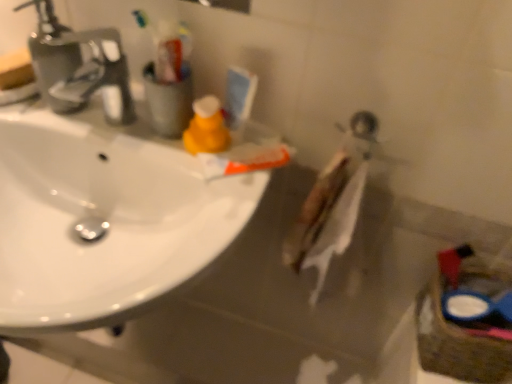
Measure the distance between white glossy sink at upper left and camera.

The depth of white glossy sink at upper left is 18.52 inches.

This screenshot has width=512, height=384. What do you see at coordinates (79, 66) in the screenshot? I see `satin nickel faucet at upper left` at bounding box center [79, 66].

Find the location of `white matte toothpaste at center`. white matte toothpaste at center is located at coordinates (244, 159).

What is the approximate width of white matte toothpaste at center?

16.40 centimeters.

What are the coordinates of `matte orange spray bottle at upper center` in the screenshot? It's located at (206, 127).

Is point (214, 158) positioned behind point (227, 129)?

That is False.

Is matte orange spray bottle at upper center at the back of white matte toothpaste at center?

No, white matte toothpaste at center's orientation is not away from matte orange spray bottle at upper center.

Is matte orange spray bottle at upper center completely or partially inside white matte toothpaste at center?

No, matte orange spray bottle at upper center is not inside white matte toothpaste at center.

From a real-world perspective, is white matte toothpaste at center on top of matte orange spray bottle at upper center?

No, from a real-world perspective, white matte toothpaste at center is not over matte orange spray bottle at upper center

From a real-world perspective, is matte orange spray bottle at upper center below white glossy sink at upper left?

Incorrect, from a real-world perspective, matte orange spray bottle at upper center is higher than white glossy sink at upper left.

Image resolution: width=512 pixels, height=384 pixels. What are the coordinates of `sink below the matte orange spray bottle at upper center (from a real-world perspective)` in the screenshot? It's located at (105, 219).

Does matte orange spray bottle at upper center turn towards white glossy sink at upper left?

No, matte orange spray bottle at upper center is not turned towards white glossy sink at upper left.

Are matte orange spray bottle at upper center and white glossy sink at upper left beside each other?

There is a gap between matte orange spray bottle at upper center and white glossy sink at upper left.

Between satin nickel faucet at upper left and matte orange spray bottle at upper center, which one has smaller width?

matte orange spray bottle at upper center.

Is matte orange spray bottle at upper center at the back of satin nickel faucet at upper left?

satin nickel faucet at upper left does not have its back to matte orange spray bottle at upper center.

Does satin nickel faucet at upper left have a lesser height compared to matte orange spray bottle at upper center?

No, satin nickel faucet at upper left is not shorter than matte orange spray bottle at upper center.

Locate an element on the screen. sink that appears below the satin nickel faucet at upper left (from a real-world perspective) is located at coordinates (105, 219).

Considering the sizes of objects white glossy sink at upper left and satin nickel faucet at upper left in the image provided, who is wider, white glossy sink at upper left or satin nickel faucet at upper left?

white glossy sink at upper left is wider.

From a real-world perspective, relative to satin nickel faucet at upper left, is white glossy sink at upper left vertically above or below?

Clearly, from a real-world perspective, white glossy sink at upper left is below satin nickel faucet at upper left.

Which is in front, point (82, 176) or point (104, 103)?

Point (104, 103)

From a real-world perspective, between white matte toothpaste at center and blue plastic basket at lower right, who is vertically lower?

From a 3D spatial view, blue plastic basket at lower right is below.

Is white matte toothpaste at center positioned with its back to blue plastic basket at lower right?

white matte toothpaste at center is not turned away from blue plastic basket at lower right.

Which of these two, white matte toothpaste at center or blue plastic basket at lower right, is bigger?

blue plastic basket at lower right.

Looking at this image, how much distance is there between white glossy sink at upper left and white matte toothpaste at center?

white glossy sink at upper left and white matte toothpaste at center are 7.62 inches apart from each other.

Looking at the image, does white glossy sink at upper left seem bigger or smaller compared to white matte toothpaste at center?

white glossy sink at upper left is bigger than white matte toothpaste at center.

Which is correct: white glossy sink at upper left is inside white matte toothpaste at center, or outside of it?

white glossy sink at upper left is not enclosed by white matte toothpaste at center.

Which of these two, white glossy sink at upper left or white matte toothpaste at center, stands taller?

white glossy sink at upper left.

Is white glossy sink at upper left at the back of white matte toothpaste at center?

No, white matte toothpaste at center's orientation is not away from white glossy sink at upper left.

Can you tell me how much white matte toothpaste at center and white glossy sink at upper left differ in facing direction?

The facing directions of white matte toothpaste at center and white glossy sink at upper left are 56.6 degrees apart.

Who is bigger, white matte toothpaste at center or white glossy sink at upper left?

white glossy sink at upper left.

Between point (242, 144) and point (56, 320), which one is positioned in front?

The point (56, 320) is in front.

Identify the location of toothpaste behind the matte orange spray bottle at upper center. The height and width of the screenshot is (384, 512). (244, 159).

Where is `sink that appears in front of the matte orange spray bottle at upper center`? This screenshot has height=384, width=512. sink that appears in front of the matte orange spray bottle at upper center is located at coordinates (105, 219).

Estimate the real-world distances between objects in this image. Which object is further from white matte toothpaste at center, white glossy sink at upper left or matte orange spray bottle at upper center?

Based on the image, white glossy sink at upper left appears to be further to white matte toothpaste at center.

Considering their positions, is white matte toothpaste at center positioned closer to satin nickel faucet at upper left than blue plastic basket at lower right?

Based on the image, white matte toothpaste at center appears to be nearer to satin nickel faucet at upper left.

Looking at the image, which one is located further to satin nickel faucet at upper left, white matte toothpaste at center or white glossy sink at upper left?

white matte toothpaste at center.

Considering their positions, is satin nickel faucet at upper left positioned further to white matte toothpaste at center than matte orange spray bottle at upper center?

Among the two, satin nickel faucet at upper left is located further to white matte toothpaste at center.

Which object lies further to the anchor point satin nickel faucet at upper left, white glossy sink at upper left or matte orange spray bottle at upper center?

Among the two, matte orange spray bottle at upper center is located further to satin nickel faucet at upper left.

Which object lies nearer to the anchor point blue plastic basket at lower right, white matte toothpaste at center or matte orange spray bottle at upper center?

Based on the image, white matte toothpaste at center appears to be nearer to blue plastic basket at lower right.

Estimate the real-world distances between objects in this image. Which object is further from white matte toothpaste at center, blue plastic basket at lower right or matte orange spray bottle at upper center?

blue plastic basket at lower right is positioned further to the anchor white matte toothpaste at center.

When comparing their distances from blue plastic basket at lower right, does white glossy sink at upper left or satin nickel faucet at upper left seem closer?

white glossy sink at upper left lies closer to blue plastic basket at lower right than the other object.

Identify the location of sink between satin nickel faucet at upper left and blue plastic basket at lower right. Image resolution: width=512 pixels, height=384 pixels. pyautogui.click(x=105, y=219).

This screenshot has width=512, height=384. Find the location of `sink between satin nickel faucet at upper left and white matte toothpaste at center from left to right`. sink between satin nickel faucet at upper left and white matte toothpaste at center from left to right is located at coordinates (105, 219).

At what (x,y) coordinates should I click in order to perform the action: click on cleaning product between white glossy sink at upper left and white matte toothpaste at center in the horizontal direction. Please return your answer as a coordinate pair (x, y). The image size is (512, 384). Looking at the image, I should click on coord(206,127).

Find the location of a particular element. toothpaste situated between satin nickel faucet at upper left and blue plastic basket at lower right from left to right is located at coordinates (244, 159).